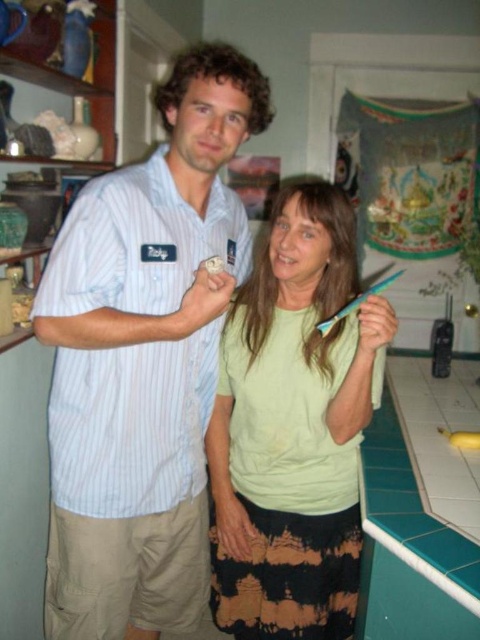
Is white striped shirt at center taller than green matte shirt at center?

Indeed, white striped shirt at center has a greater height compared to green matte shirt at center.

The width and height of the screenshot is (480, 640). What do you see at coordinates (144, 358) in the screenshot? I see `white striped shirt at center` at bounding box center [144, 358].

You are a GUI agent. You are given a task and a screenshot of the screen. Output one action in this format:
    pyautogui.click(x=<x>, y=<y>)
    Task: Click on the white striped shirt at center
    This screenshot has width=480, height=640.
    Given the screenshot: What is the action you would take?
    pyautogui.click(x=144, y=358)

Does white striped shirt at center appear over green tile countertop at lower right?

Yes, white striped shirt at center is above green tile countertop at lower right.

This screenshot has height=640, width=480. What do you see at coordinates (144, 358) in the screenshot?
I see `white striped shirt at center` at bounding box center [144, 358].

This screenshot has height=640, width=480. In order to click on white striped shirt at center in this screenshot , I will do `click(144, 358)`.

Is point (323, 280) closer to viewer compared to point (432, 628)?

That is False.

Which of these two, green matte shirt at center or green tile countertop at lower right, stands taller?

With more height is green matte shirt at center.

Is point (283, 436) positioned in front of point (399, 525)?

No.

Where is `green matte shirt at center`? green matte shirt at center is located at coordinates (294, 428).